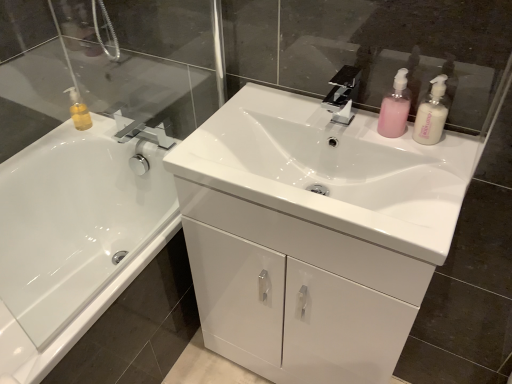
Question: From a real-world perspective, is pink plastic pump bottle at upper right, the 3th toiletry positioned from the back, located beneath white glossy sink at center?

Choices:
 (A) no
 (B) yes

Answer: (A)

Question: Is pink plastic pump bottle at upper right, the 3th toiletry positioned from the back, looking in the opposite direction of white glossy sink at center?

Choices:
 (A) yes
 (B) no

Answer: (B)

Question: Is pink plastic pump bottle at upper right, which ranks as the first toiletry in front-to-back order, thinner than white glossy sink at center?

Choices:
 (A) no
 (B) yes

Answer: (B)

Question: From the image's perspective, does pink plastic pump bottle at upper right, the 3th toiletry positioned from the back, appear lower than white glossy sink at center?

Choices:
 (A) no
 (B) yes

Answer: (A)

Question: Considering the relative sizes of pink plastic pump bottle at upper right, marked as the 1th toiletry in a right-to-left arrangement, and white glossy sink at center in the image provided, is pink plastic pump bottle at upper right, marked as the 1th toiletry in a right-to-left arrangement, shorter than white glossy sink at center?

Choices:
 (A) no
 (B) yes

Answer: (B)

Question: Considering the positions of point (234, 208) and point (353, 215), is point (234, 208) closer or farther from the camera than point (353, 215)?

Choices:
 (A) farther
 (B) closer

Answer: (A)

Question: In the image, is white glossy cabinet at center positioned in front of or behind white glossy sink at center?

Choices:
 (A) front
 (B) behind

Answer: (B)

Question: In terms of height, does white glossy cabinet at center look taller or shorter compared to white glossy sink at center?

Choices:
 (A) tall
 (B) short

Answer: (A)

Question: From the image's perspective, is white glossy cabinet at center positioned above or below white glossy sink at center?

Choices:
 (A) below
 (B) above

Answer: (A)

Question: Is pink plastic pump bottle at upper right, the 3th toiletry positioned from the back, situated inside white glossy sink at center or outside?

Choices:
 (A) outside
 (B) inside

Answer: (A)

Question: Is pink plastic pump bottle at upper right, the 3th toiletry positioned from the back, in front of or behind white glossy sink at center in the image?

Choices:
 (A) behind
 (B) front

Answer: (A)

Question: Considering the positions of pink plastic pump bottle at upper right, which ranks as the first toiletry in front-to-back order, and white glossy sink at center in the image, is pink plastic pump bottle at upper right, which ranks as the first toiletry in front-to-back order, bigger or smaller than white glossy sink at center?

Choices:
 (A) small
 (B) big

Answer: (A)

Question: Does point (436, 122) appear closer or farther from the camera than point (325, 147)?

Choices:
 (A) farther
 (B) closer

Answer: (B)

Question: From a real-world perspective, is white glossy sink at center physically located above or below black glossy faucet at center?

Choices:
 (A) below
 (B) above

Answer: (A)

Question: From the image's perspective, is white glossy sink at center above or below black glossy faucet at center?

Choices:
 (A) below
 (B) above

Answer: (A)